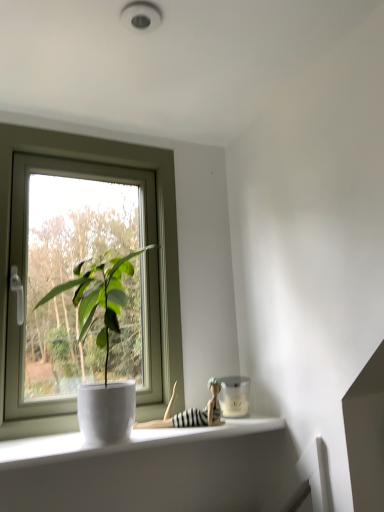
The width and height of the screenshot is (384, 512). Find the location of `vacant area on top of white plastic window at left (from a real-world perspective)`. vacant area on top of white plastic window at left (from a real-world perspective) is located at coordinates (86, 136).